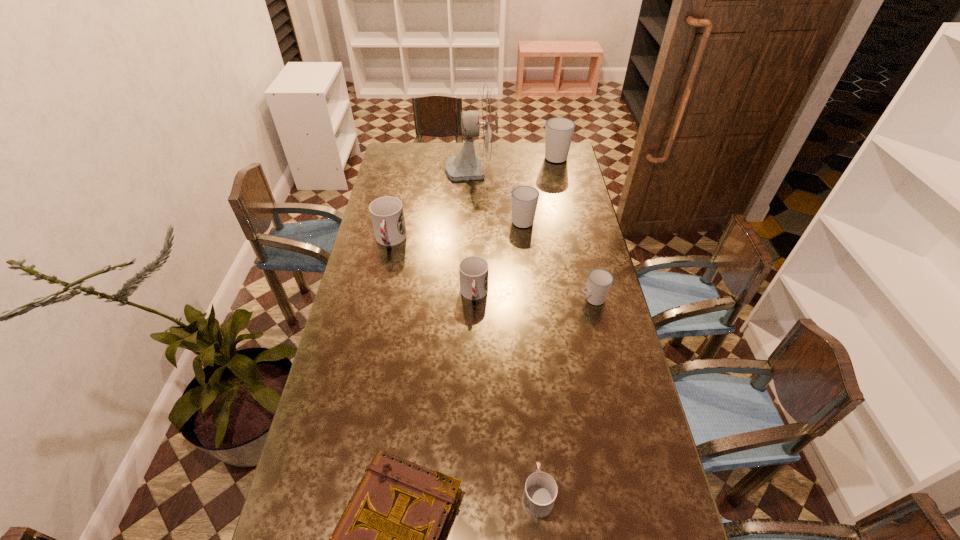
Locate an element on the screen. This screenshot has width=960, height=540. red cup that stands as the second closest to the second nearest white cup is located at coordinates (387, 215).

The height and width of the screenshot is (540, 960). Identify the location of blank area in the image that satisfies the following two spatial constraints: 1. in front of the fan to blow air; 2. on the side of the leftmost cup where the handle is located. (469, 240).

I want to click on free point that satisfies the following two spatial constraints: 1. on the side of the second shortest object where the handle is located; 2. in front of the tallest object to blow air, so click(x=510, y=168).